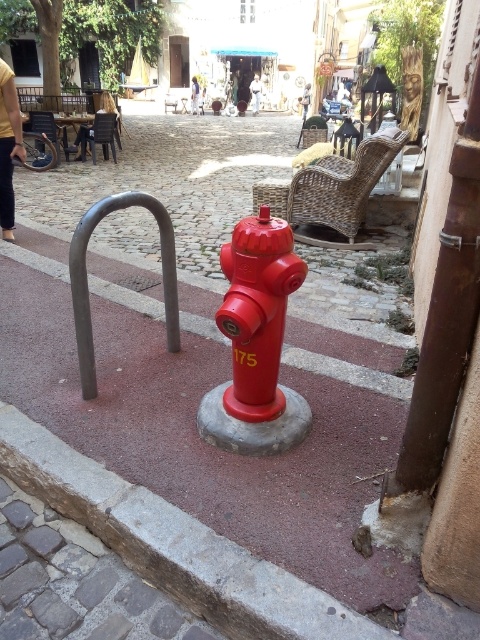
Is woven rattan chair at center wider than polished metal bike rack at center?

Yes, woven rattan chair at center is wider than polished metal bike rack at center.

Does point (299, 221) lie behind point (81, 236)?

Yes, it is behind point (81, 236).

Between point (304, 177) and point (163, 218), which one is positioned in front?

Point (163, 218)

Where is `woven rattan chair at center`? woven rattan chair at center is located at coordinates (343, 186).

Is rusty metal pole at right taller than woven rattan chair at center?

Yes.

Does rusty metal pole at right appear over woven rattan chair at center?

Incorrect, rusty metal pole at right is not positioned above woven rattan chair at center.

You are a GUI agent. You are given a task and a screenshot of the screen. Output one action in this format:
    pyautogui.click(x=<x>, y=<y>)
    Task: Click on the rusty metal pole at right
    The height and width of the screenshot is (640, 480).
    Given the screenshot: What is the action you would take?
    pyautogui.click(x=444, y=321)

Can you confirm if rusty metal pole at right is taller than shiny red fire hydrant at center?

Yes.

This screenshot has width=480, height=640. Describe the element at coordinates (444, 321) in the screenshot. I see `rusty metal pole at right` at that location.

I want to click on rusty metal pole at right, so click(x=444, y=321).